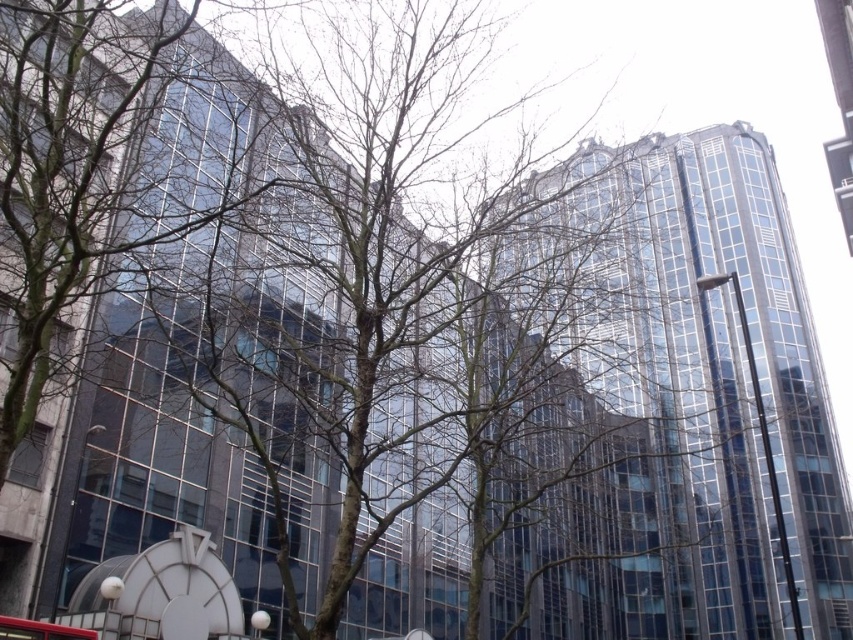
Question: Among these points, which one is nearest to the camera?

Choices:
 (A) (178, 600)
 (B) (35, 620)

Answer: (B)

Question: Can you confirm if white glossy clock at lower left is positioned to the right of red rubber bus at center?

Choices:
 (A) yes
 (B) no

Answer: (A)

Question: Can you confirm if white glossy clock at lower left is positioned to the left of red rubber bus at center?

Choices:
 (A) yes
 (B) no

Answer: (B)

Question: Considering the relative positions of white glossy clock at lower left and red rubber bus at center in the image provided, where is white glossy clock at lower left located with respect to red rubber bus at center?

Choices:
 (A) left
 (B) right

Answer: (B)